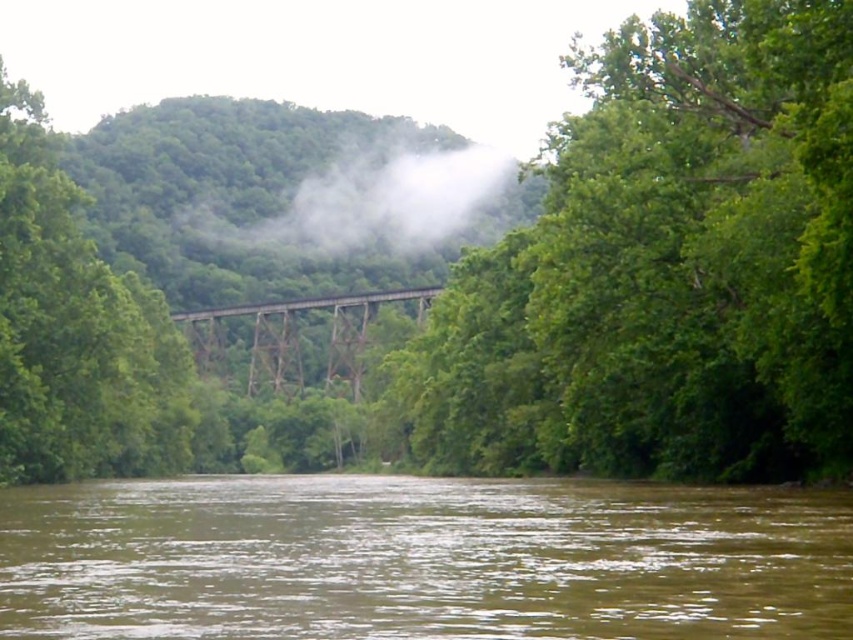
You are standing at the point marked by the coordinates point (663, 268). Looking around, what object is located at your current position?

The green leafy tree at upper center is located at point (663, 268).

You are a bird flying over the landscape. You see the green leafy tree at upper center and the brown wooden train bridge at center. Which object is higher from the ground?

The green leafy tree at upper center is positioned over the brown wooden train bridge at center, so it is higher from the ground.